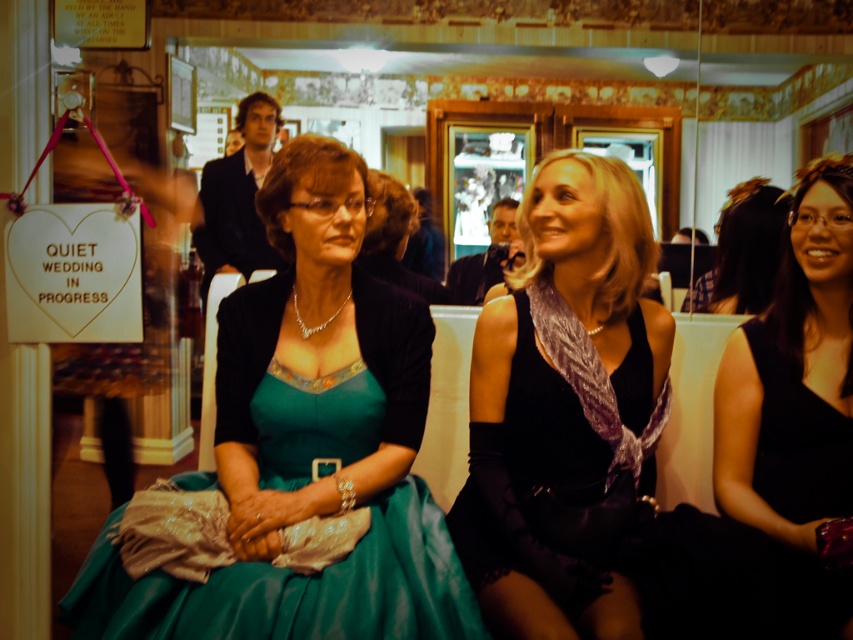
You are a photographer at the wedding reception. You need to position a backdrop behind the teal satin dress at center and the black satin dress at right so that it covers both dresses equally. Given their height difference, where should you place the backdrop to ensure it covers both adequately?

The teal satin dress at center is much taller than the black satin dress at right. To cover both adequately, position the backdrop so that its lower edge reaches the waist of the taller teal satin dress at center while ensuring the upper edge extends above the head of the shorter black satin dress at right. This placement will ensure both are fully covered without leaving gaps.

You are a photographer at the wedding reception. You need to position two guests wearing the teal satin dress at center and the satin black dress at center for a photo. Given their dress widths, which guest should you place closer to the camera to ensure both fit in the frame?

The teal satin dress at center is wider than the satin black dress at center, so placing the guest in the teal satin dress at center closer to the camera will help accommodate its wider width within the frame.

You are a photographer at the wedding reception. You need to capture a photo of the two women wearing the teal satin dress at center and the satin black dress at center. Which dress should you focus on first if you want to ensure both are in the frame?

The teal satin dress at center is located above the satin black dress at center. To ensure both are in the frame, focus on the teal satin dress at center first as it is positioned higher up, allowing the camera to capture the lower positioned satin black dress at center in the same shot.